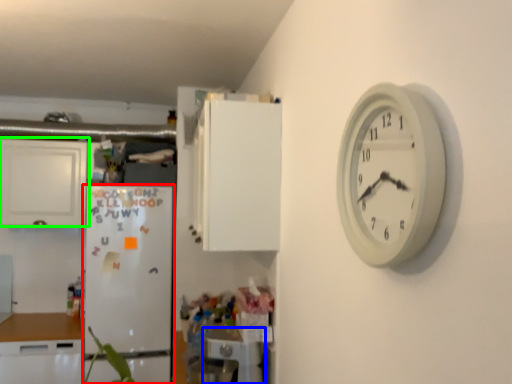
Question: Estimate the real-world distances between objects in this image. Which object is farther from fridge (highlighted by a red box), appliance (highlighted by a blue box) or cabinetry (highlighted by a green box)?

Choices:
 (A) appliance
 (B) cabinetry

Answer: (A)